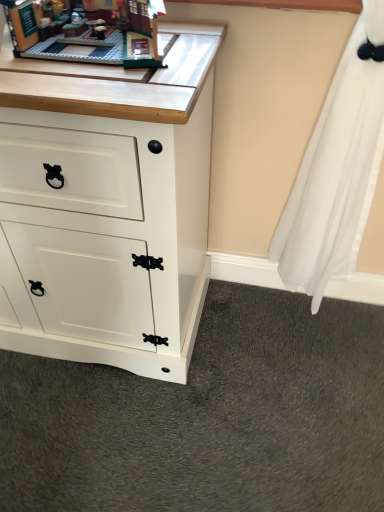
This screenshot has height=512, width=384. I want to click on white matte cabinet at center, so click(x=108, y=212).

The image size is (384, 512). Describe the element at coordinates (108, 212) in the screenshot. I see `white matte cabinet at center` at that location.

Where is `brick-like lego set at upper left`? The width and height of the screenshot is (384, 512). brick-like lego set at upper left is located at coordinates click(83, 36).

In order to face brick-like lego set at upper left, should I rotate leftwards or rightwards?

You should rotate left by 12.091 degrees.

What is the approximate height of brick-like lego set at upper left?

3.14 inches.

This screenshot has width=384, height=512. What do you see at coordinates (83, 36) in the screenshot? I see `brick-like lego set at upper left` at bounding box center [83, 36].

What are the coordinates of `white matte cabinet at center` in the screenshot? It's located at (108, 212).

Between brick-like lego set at upper left and white matte cabinet at center, which one appears on the left side from the viewer's perspective?

Positioned to the left is white matte cabinet at center.

Is brick-like lego set at upper left in front of or behind white matte cabinet at center in the image?

brick-like lego set at upper left is positioned farther from the viewer than white matte cabinet at center.

Between point (148, 5) and point (174, 115), which one is positioned in front?

The point (174, 115) is in front.

From the image's perspective, between brick-like lego set at upper left and white matte cabinet at center, which one is located above?

From the image's view, brick-like lego set at upper left is above.

From a real-world perspective, is brick-like lego set at upper left physically located above or below white matte cabinet at center?

From a real-world perspective, brick-like lego set at upper left is physically above white matte cabinet at center.

Does brick-like lego set at upper left have a greater width compared to white matte cabinet at center?

No.

In terms of height, does brick-like lego set at upper left look taller or shorter compared to white matte cabinet at center?

Considering their sizes, brick-like lego set at upper left has less height than white matte cabinet at center.

Based on the photo, is brick-like lego set at upper left bigger than white matte cabinet at center?

No.

Does brick-like lego set at upper left contain white matte cabinet at center?

No, brick-like lego set at upper left does not contain white matte cabinet at center.

Based on the photo, are brick-like lego set at upper left and white matte cabinet at center far apart?

No, brick-like lego set at upper left is not far away from white matte cabinet at center.

Is brick-like lego set at upper left turned away from white matte cabinet at center?

No, brick-like lego set at upper left is not facing away from white matte cabinet at center.

How different are the orientations of brick-like lego set at upper left and white matte cabinet at center in degrees?

3.06 degrees separate the facing orientations of brick-like lego set at upper left and white matte cabinet at center.

The width and height of the screenshot is (384, 512). I want to click on toy above the white matte cabinet at center (from the image's perspective), so click(x=83, y=36).

Considering the positions of objects white matte cabinet at center and brick-like lego set at upper left in the image provided, who is more to the left, white matte cabinet at center or brick-like lego set at upper left?

From the viewer's perspective, white matte cabinet at center appears more on the left side.

In the image, is white matte cabinet at center positioned in front of or behind brick-like lego set at upper left?

In the image, white matte cabinet at center appears in front of brick-like lego set at upper left.

Considering the points (75, 117) and (56, 38), which point is in front, point (75, 117) or point (56, 38)?

The point (75, 117) is closer to the camera.

From the image's perspective, between white matte cabinet at center and brick-like lego set at upper left, who is located below?

white matte cabinet at center.

From a real-world perspective, does white matte cabinet at center stand above brick-like lego set at upper left?

No.

Can you confirm if white matte cabinet at center is thinner than brick-like lego set at upper left?

No.

Which of these two, white matte cabinet at center or brick-like lego set at upper left, stands taller?

With more height is white matte cabinet at center.

Is white matte cabinet at center smaller than brick-like lego set at upper left?

Actually, white matte cabinet at center might be larger than brick-like lego set at upper left.

Is white matte cabinet at center not within brick-like lego set at upper left?

Absolutely, white matte cabinet at center is external to brick-like lego set at upper left.

Is white matte cabinet at center not close to brick-like lego set at upper left?

No, white matte cabinet at center is not far from brick-like lego set at upper left.

Is white matte cabinet at center facing away from brick-like lego set at upper left?

No, white matte cabinet at center is not facing away from brick-like lego set at upper left.

Identify the location of the chest of drawers below the brick-like lego set at upper left (from a real-world perspective). (108, 212).

The width and height of the screenshot is (384, 512). Find the location of `chest of drawers on the left of brick-like lego set at upper left`. chest of drawers on the left of brick-like lego set at upper left is located at coordinates (108, 212).

Where is `chest of drawers below the brick-like lego set at upper left (from a real-world perspective)`? Image resolution: width=384 pixels, height=512 pixels. chest of drawers below the brick-like lego set at upper left (from a real-world perspective) is located at coordinates (108, 212).